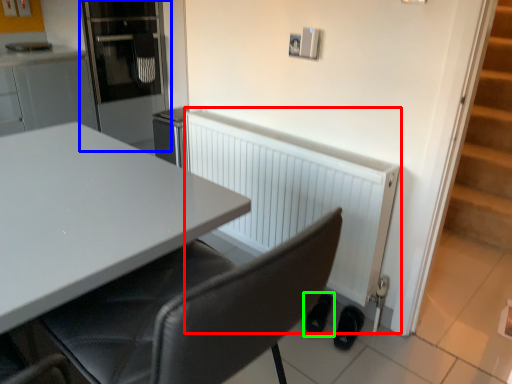
Question: Which object is the closest to the radiator (highlighted by a red box)? Choose among these: appliance (highlighted by a blue box) or footwear (highlighted by a green box).

Choices:
 (A) appliance
 (B) footwear

Answer: (B)